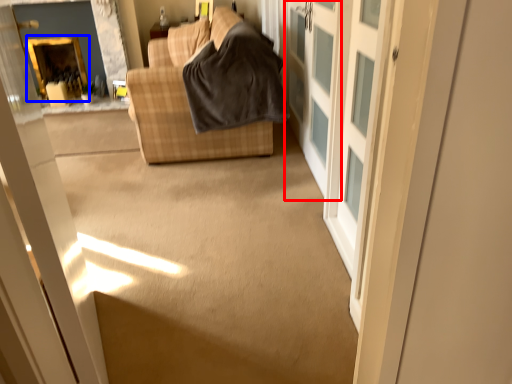
Question: Among these objects, which one is farthest to the camera, screen door (highlighted by a red box) or fireplace (highlighted by a blue box)?

Choices:
 (A) screen door
 (B) fireplace

Answer: (B)